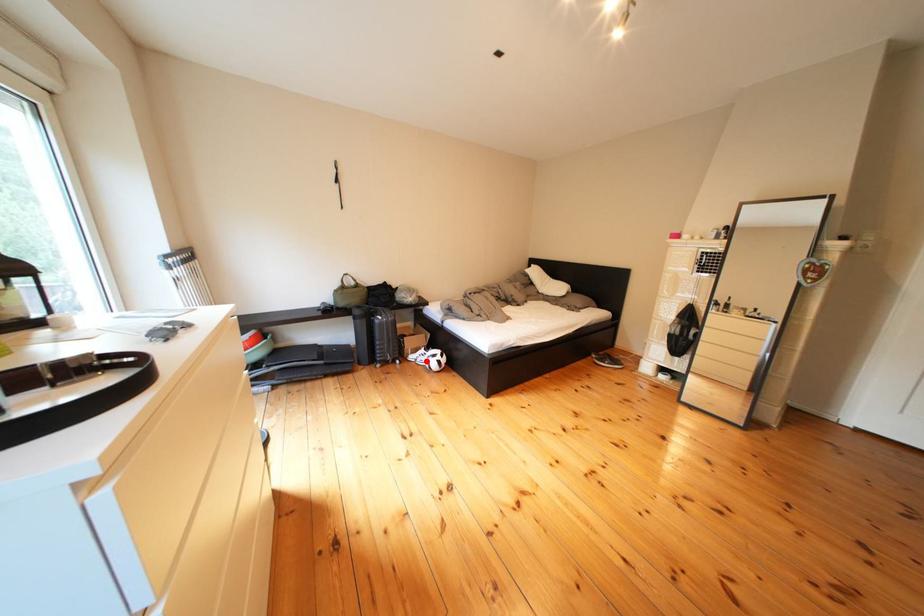
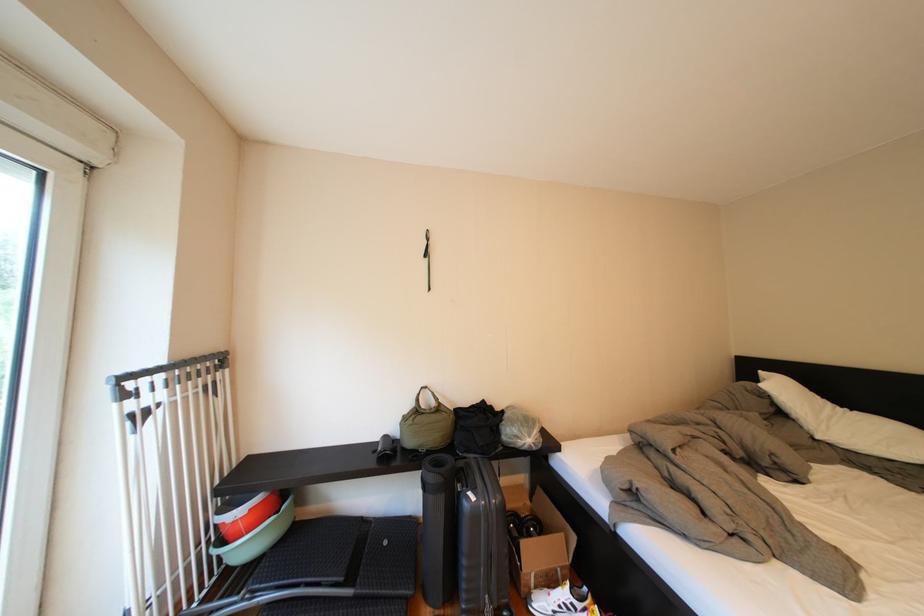
Question: I am providing you with two images of the same scene from different viewpoints. In image1, a red point is highlighted. Considering the same 3D point in image2, which of the following is correct?

Choices:
 (A) It is closer
 (B) It is farther

Answer: (A)